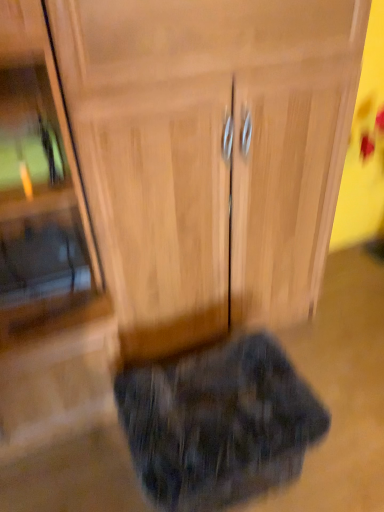
Find the location of a particular element. The height and width of the screenshot is (512, 384). free space to the right of fluffy dark gray cat at lower center is located at coordinates (342, 440).